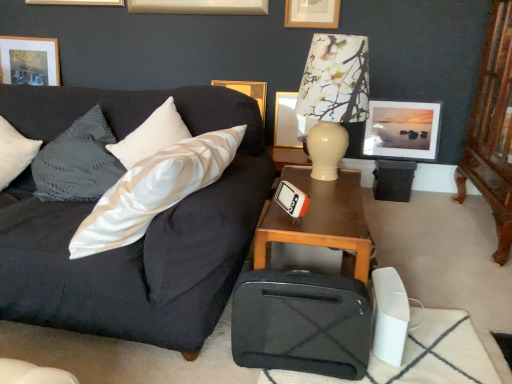
Question: Is dark gray fabric couch at left wider than matte gold picture frame at upper center, which is the third picture frame in left-to-right order?

Choices:
 (A) yes
 (B) no

Answer: (A)

Question: Does dark gray fabric couch at left have a lesser height compared to matte gold picture frame at upper center, the 3th picture frame when ordered from right to left?

Choices:
 (A) yes
 (B) no

Answer: (B)

Question: Can you confirm if dark gray fabric couch at left is bigger than matte gold picture frame at upper center, the 3th picture frame when ordered from right to left?

Choices:
 (A) yes
 (B) no

Answer: (A)

Question: Considering the relative sizes of dark gray fabric couch at left and matte gold picture frame at upper center, which is the third picture frame in left-to-right order, in the image provided, is dark gray fabric couch at left smaller than matte gold picture frame at upper center, which is the third picture frame in left-to-right order,?

Choices:
 (A) no
 (B) yes

Answer: (A)

Question: From a real-world perspective, is dark gray fabric couch at left located higher than matte gold picture frame at upper center, the 3th picture frame when ordered from right to left?

Choices:
 (A) no
 (B) yes

Answer: (B)

Question: In terms of height, does matte gold picture frame at upper center, which is the third picture frame in left-to-right order, look taller or shorter compared to brown wooden table at center?

Choices:
 (A) short
 (B) tall

Answer: (A)

Question: Considering the positions of point (292, 102) and point (254, 233), is point (292, 102) closer or farther from the camera than point (254, 233)?

Choices:
 (A) closer
 (B) farther

Answer: (B)

Question: Considering the relative positions of matte gold picture frame at upper center, which is the third picture frame in left-to-right order, and brown wooden table at center in the image provided, is matte gold picture frame at upper center, which is the third picture frame in left-to-right order, to the left or to the right of brown wooden table at center?

Choices:
 (A) left
 (B) right

Answer: (B)

Question: Is matte gold picture frame at upper center, which is the third picture frame in left-to-right order, in front of or behind brown wooden table at center in the image?

Choices:
 (A) front
 (B) behind

Answer: (B)

Question: From a real-world perspective, is matte glass picture frame at upper right, the first picture frame positioned from the right, physically located above or below gold metallic picture frame at upper center, the second picture frame in the left-to-right sequence?

Choices:
 (A) above
 (B) below

Answer: (B)

Question: Considering their positions, is matte glass picture frame at upper right, the first picture frame positioned from the right, located in front of or behind gold metallic picture frame at upper center, positioned as the 4th picture frame in right-to-left order?

Choices:
 (A) front
 (B) behind

Answer: (A)

Question: Considering the relative positions of matte glass picture frame at upper right, the first picture frame positioned from the right, and gold metallic picture frame at upper center, positioned as the 4th picture frame in right-to-left order, in the image provided, is matte glass picture frame at upper right, the first picture frame positioned from the right, to the left or to the right of gold metallic picture frame at upper center, positioned as the 4th picture frame in right-to-left order,?

Choices:
 (A) right
 (B) left

Answer: (A)

Question: Which is correct: matte glass picture frame at upper right, the first picture frame positioned from the right, is inside gold metallic picture frame at upper center, positioned as the 4th picture frame in right-to-left order, or outside of it?

Choices:
 (A) outside
 (B) inside

Answer: (A)

Question: Choose the correct answer: Is matte gold picture frame at upper left, which is the fifth picture frame from right to left, inside matte gold picture frame at upper center, which is the third picture frame in left-to-right order, or outside it?

Choices:
 (A) inside
 (B) outside

Answer: (B)

Question: From the image's perspective, is matte gold picture frame at upper left, positioned as the 1th picture frame in left-to-right order, located above or below matte gold picture frame at upper center, the 3th picture frame when ordered from right to left?

Choices:
 (A) below
 (B) above

Answer: (B)